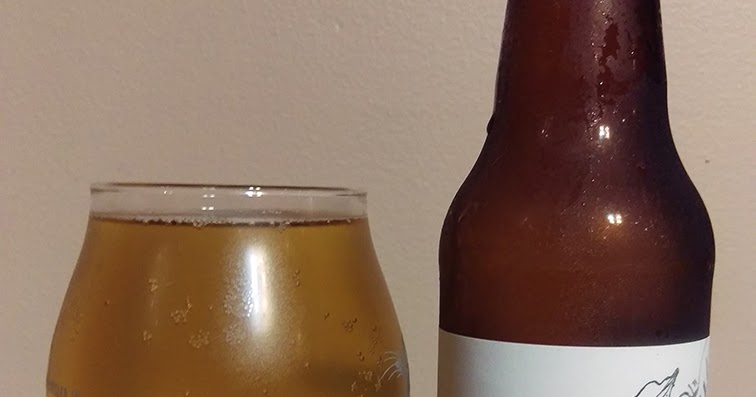
You are a GUI agent. You are given a task and a screenshot of the screen. Output one action in this format:
    pyautogui.click(x=<x>, y=<y>)
    Task: Click on the glass
    
    Given the screenshot: What is the action you would take?
    pyautogui.click(x=242, y=209)